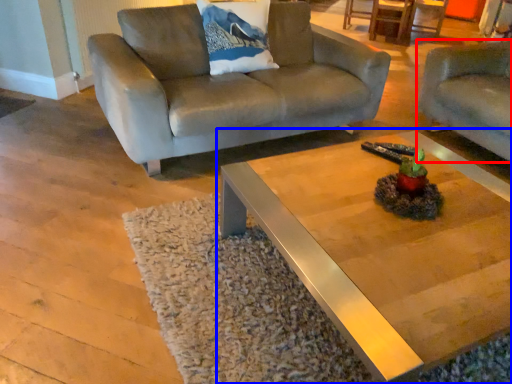
Question: Which object appears farthest to the camera in this image, studio couch (highlighted by a red box) or coffee table (highlighted by a blue box)?

Choices:
 (A) studio couch
 (B) coffee table

Answer: (A)